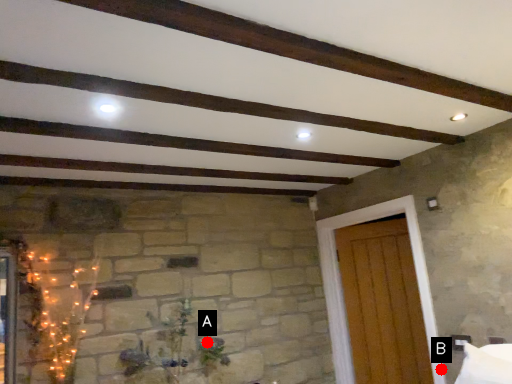
Question: Two points are circled on the image, labeled by A and B beside each circle. Which point is closer to the camera?

Choices:
 (A) A is closer
 (B) B is closer

Answer: (B)